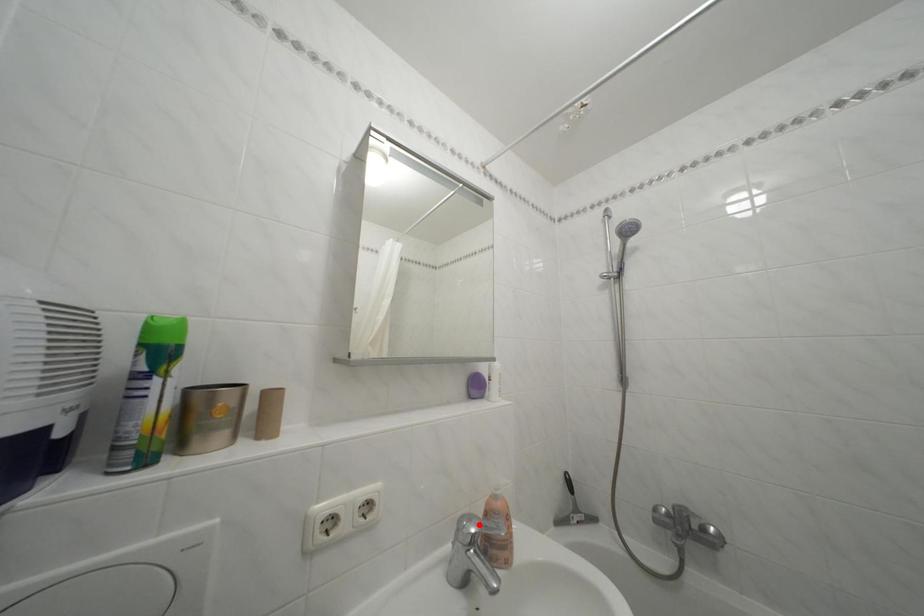
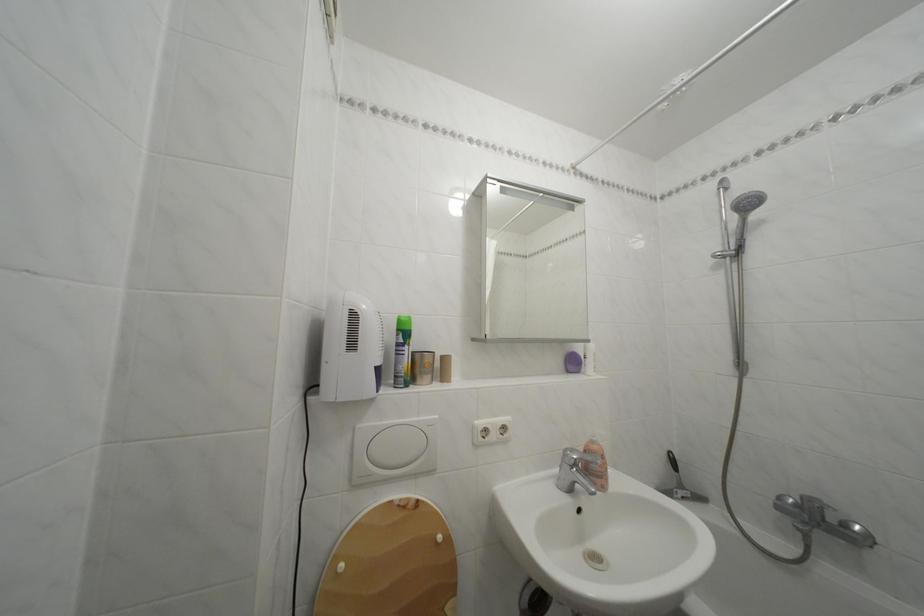
Locate, in the second image, the point that corresponds to the highlighted location in the first image.

(581, 456)